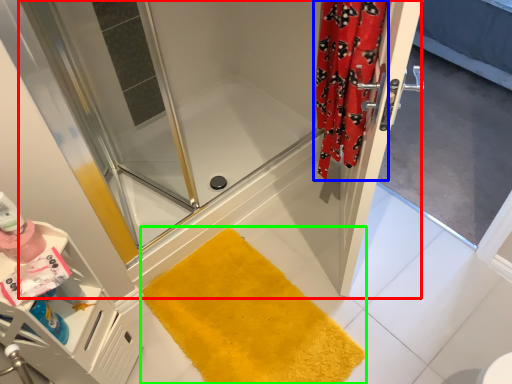
Question: Estimate the real-world distances between objects in this image. Which object is farther from shower door (highlighted by a red box), shower curtain (highlighted by a blue box) or bath mat (highlighted by a green box)?

Choices:
 (A) shower curtain
 (B) bath mat

Answer: (B)